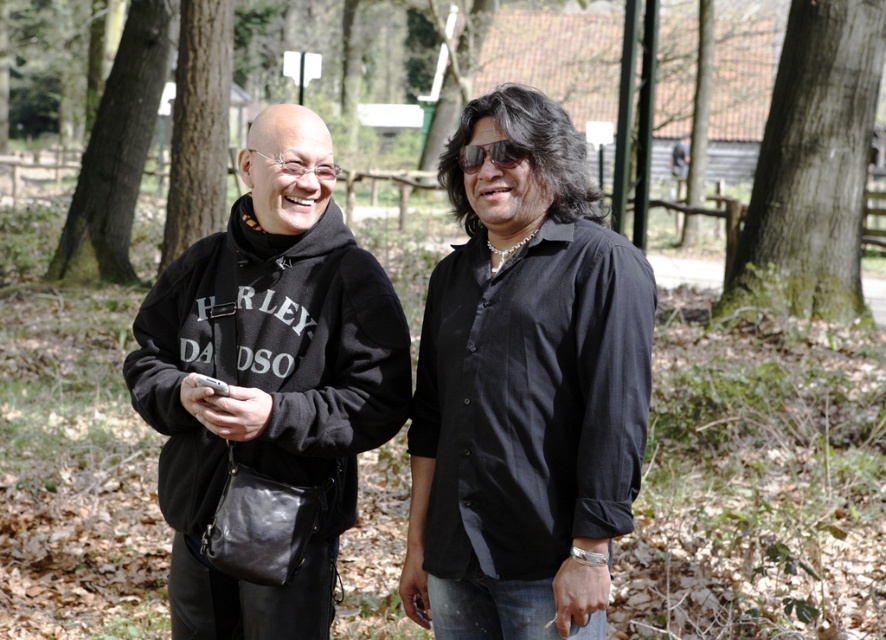
You are trying to locate the black leather hoodie at left in the image. Based on the coordinates provided, can you determine its position relative to the center of the image?

The black leather hoodie at left is located at point 0.588 on the x axis and 0.304 on the y axis, which places it to the right and slightly above the center of the image.

You are a hiker trying to identify landmarks in the woods. You see a point marked at coordinates (812, 164). Which landmark does this point indicate?

The point at coordinates (812, 164) indicates the green mossy bark tree at right.

You are a photographer trying to capture a portrait of the two people in the scene. The camera you are using has a depth of field that can only focus on objects with a width of 30 cm or less. Given that the black leather hoodie at left is thinner than the green mossy bark tree at right, will the camera be able to focus on both subjects simultaneously?

The black leather hoodie at left is thinner than the green mossy bark tree at right, so the camera can focus on both subjects since the hoodie is within the 30 cm width limit and the tree exceeds it but depth of field allows focusing on the hoodie while the tree may be slightly out of focus depending on the lens settings.